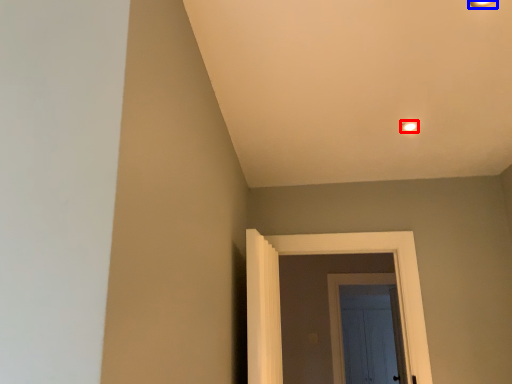
Question: Which object is closer to the camera taking this photo, light fixture (highlighted by a red box) or light fixture (highlighted by a blue box)?

Choices:
 (A) light fixture
 (B) light fixture

Answer: (B)